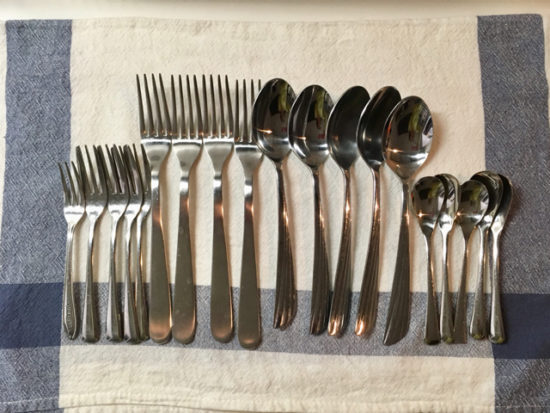
Image resolution: width=550 pixels, height=413 pixels. In order to click on large spoons in this screenshot , I will do `click(267, 137)`, `click(304, 137)`, `click(345, 134)`, `click(371, 130)`, `click(407, 137)`.